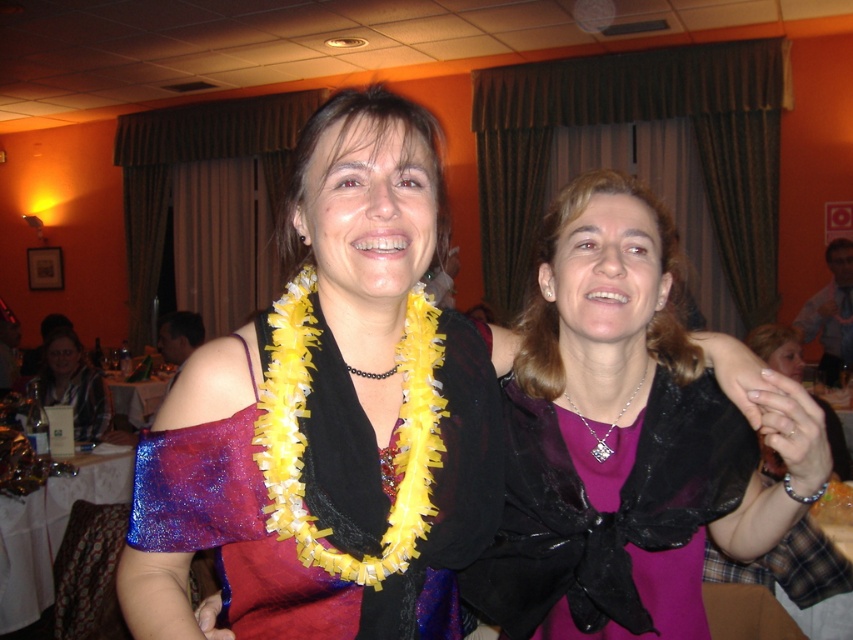
Is purple satin dress at center to the left of plaid shirt at left from the viewer's perspective?

In fact, purple satin dress at center is to the right of plaid shirt at left.

Is purple satin dress at center below plaid shirt at left?

No.

This screenshot has height=640, width=853. What do you see at coordinates (605, 513) in the screenshot?
I see `purple satin dress at center` at bounding box center [605, 513].

Where is `purple satin dress at center`? The height and width of the screenshot is (640, 853). purple satin dress at center is located at coordinates (605, 513).

Between shiny purple fabric dress at center and purple satin dress at center, which one appears on the left side from the viewer's perspective?

From the viewer's perspective, shiny purple fabric dress at center appears more on the left side.

Can you confirm if shiny purple fabric dress at center is taller than purple satin dress at center?

Correct, shiny purple fabric dress at center is much taller as purple satin dress at center.

Which is behind, point (486, 461) or point (613, 556)?

The point (613, 556) is more distant.

At what (x,y) coordinates should I click in order to perform the action: click on shiny purple fabric dress at center. Please return your answer as a coordinate pair (x, y). The height and width of the screenshot is (640, 853). Looking at the image, I should click on (293, 538).

Is purple satin blouse at center taller than shiny purple fabric dress at center?

Yes, purple satin blouse at center is taller than shiny purple fabric dress at center.

What do you see at coordinates (614, 438) in the screenshot?
I see `purple satin blouse at center` at bounding box center [614, 438].

Describe the element at coordinates (614, 438) in the screenshot. This screenshot has width=853, height=640. I see `purple satin blouse at center` at that location.

Identify the location of purple satin blouse at center. (614, 438).